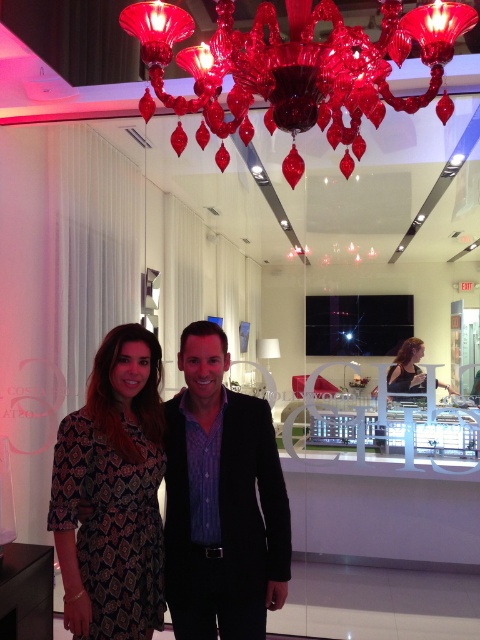
Question: Which point is farther to the camera?

Choices:
 (A) (396, 48)
 (B) (424, 374)
 (C) (132, 572)
 (D) (253, 506)

Answer: (B)

Question: Is the position of ruby glass chandelier at upper center less distant than that of matte black dress at center?

Choices:
 (A) no
 (B) yes

Answer: (B)

Question: Based on their relative distances, which object is farther from the matte black suit at center?

Choices:
 (A) ruby glass chandelier at upper center
 (B) patterned fabric dress at left

Answer: (A)

Question: Estimate the real-world distances between objects in this image. Which object is closer to the ruby glass chandelier at upper center?

Choices:
 (A) matte black suit at center
 (B) patterned fabric dress at left

Answer: (A)

Question: Does ruby glass chandelier at upper center have a greater width compared to patterned fabric dress at left?

Choices:
 (A) no
 (B) yes

Answer: (B)

Question: Can you confirm if matte black suit at center is bigger than patterned fabric dress at left?

Choices:
 (A) yes
 (B) no

Answer: (B)